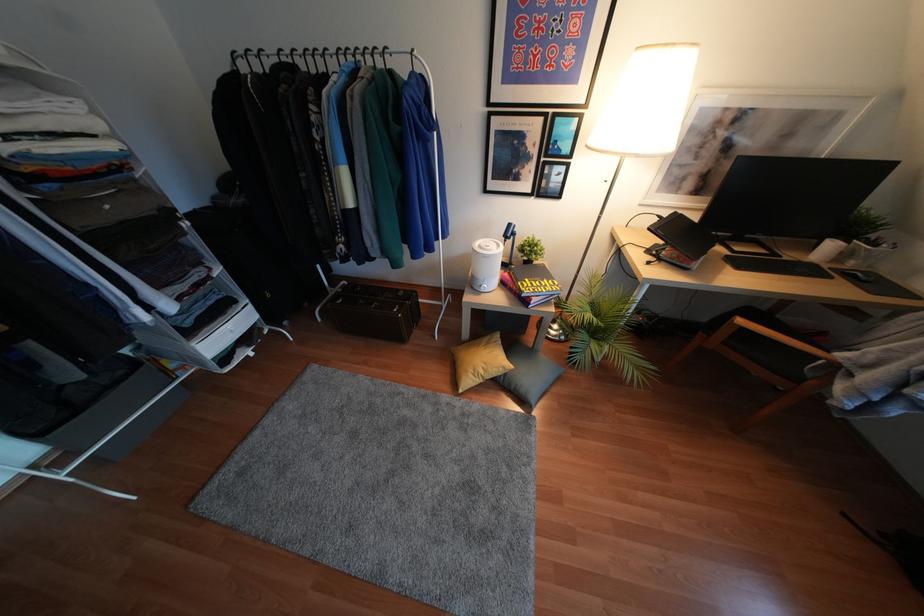
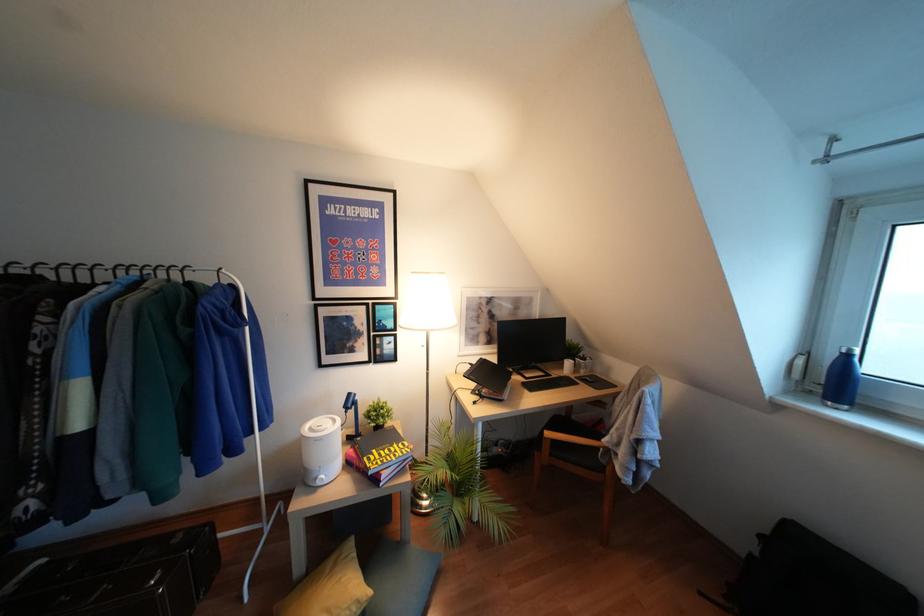
The images are taken continuously from a first-person perspective. In which direction is your viewpoint rotating?

The camera's rotation is toward right-up.